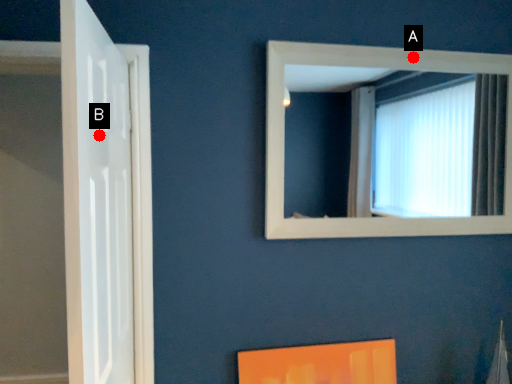
Question: Two points are circled on the image, labeled by A and B beside each circle. Which point appears closest to the camera in this image?

Choices:
 (A) A is closer
 (B) B is closer

Answer: (B)